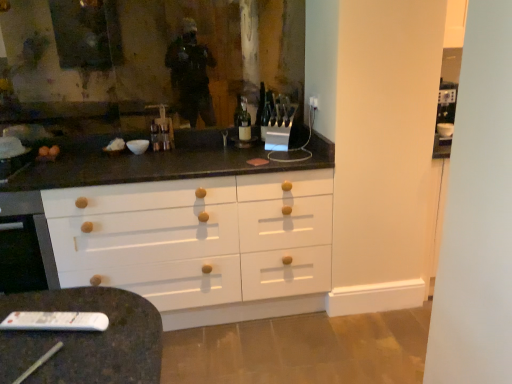
Question: Is white plastic remote at lower left at the left side of matte glass bottle at center?

Choices:
 (A) no
 (B) yes

Answer: (B)

Question: Is white plastic remote at lower left shorter than matte glass bottle at center?

Choices:
 (A) no
 (B) yes

Answer: (B)

Question: Considering the relative sizes of white plastic remote at lower left and matte glass bottle at center in the image provided, is white plastic remote at lower left taller than matte glass bottle at center?

Choices:
 (A) yes
 (B) no

Answer: (B)

Question: Can you confirm if white plastic remote at lower left is thinner than matte glass bottle at center?

Choices:
 (A) no
 (B) yes

Answer: (B)

Question: Can you confirm if white plastic remote at lower left is bigger than matte glass bottle at center?

Choices:
 (A) no
 (B) yes

Answer: (A)

Question: Does white plastic remote at lower left have a greater width compared to matte glass bottle at center?

Choices:
 (A) yes
 (B) no

Answer: (B)

Question: Is matte glass bottle at center outside of white plastic remote at lower left?

Choices:
 (A) no
 (B) yes

Answer: (B)

Question: Is matte glass bottle at center next to white plastic remote at lower left?

Choices:
 (A) yes
 (B) no

Answer: (B)

Question: From a real-world perspective, is matte glass bottle at center on top of white plastic remote at lower left?

Choices:
 (A) yes
 (B) no

Answer: (A)

Question: Can you confirm if matte glass bottle at center is taller than white plastic remote at lower left?

Choices:
 (A) yes
 (B) no

Answer: (A)

Question: Is matte glass bottle at center further to the viewer compared to white plastic remote at lower left?

Choices:
 (A) yes
 (B) no

Answer: (A)

Question: From the image's perspective, would you say matte glass bottle at center is shown under white plastic remote at lower left?

Choices:
 (A) yes
 (B) no

Answer: (B)

Question: In terms of width, does white plastic remote at lower left look wider or thinner when compared to matte glass bottle at center?

Choices:
 (A) thin
 (B) wide

Answer: (A)